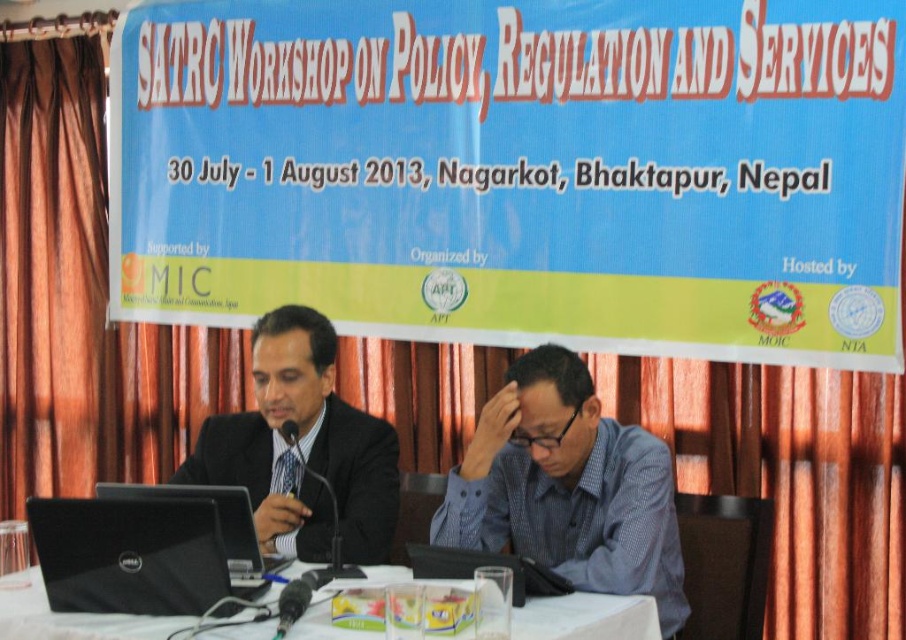
Question: Which object appears closest to the camera in this image?

Choices:
 (A) black matte laptop at left
 (B) blue checkered shirt at center
 (C) black glossy suit at center
 (D) white cloth table at center

Answer: (D)

Question: Is blue checkered shirt at center positioned at the back of white cloth table at center?

Choices:
 (A) no
 (B) yes

Answer: (B)

Question: Which point is closer to the camera?

Choices:
 (A) (225, 612)
 (B) (219, 428)
 (C) (248, 547)
 (D) (267, 628)

Answer: (D)

Question: Can you confirm if black matte laptop at left is positioned to the left of white cloth table at center?

Choices:
 (A) yes
 (B) no

Answer: (A)

Question: Which of these objects is positioned closest to the black glossy suit at center?

Choices:
 (A) white cloth table at center
 (B) black matte laptop at left
 (C) blue checkered shirt at center
 (D) dell matte black laptop at lower left

Answer: (D)

Question: Is white cloth table at center above dell matte black laptop at lower left?

Choices:
 (A) no
 (B) yes

Answer: (A)